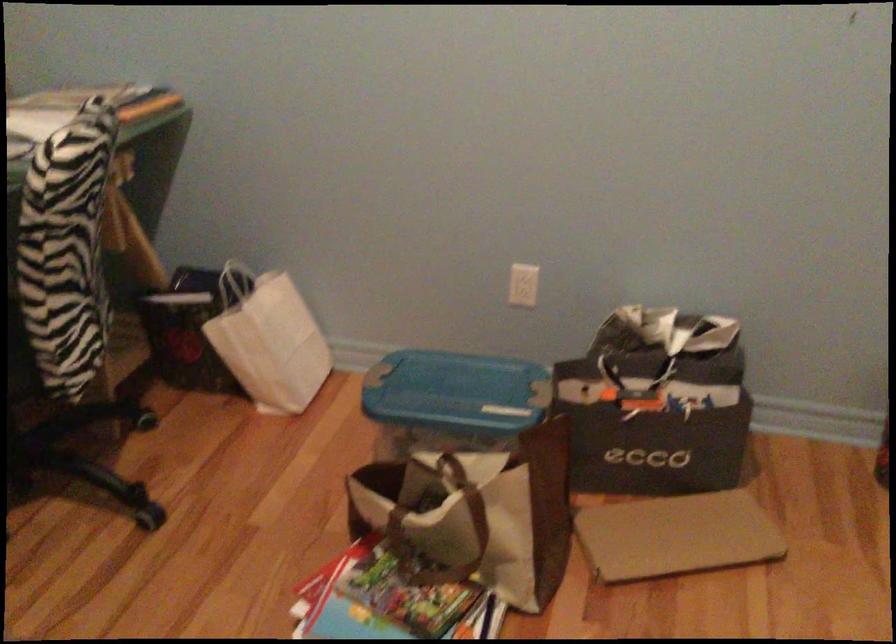
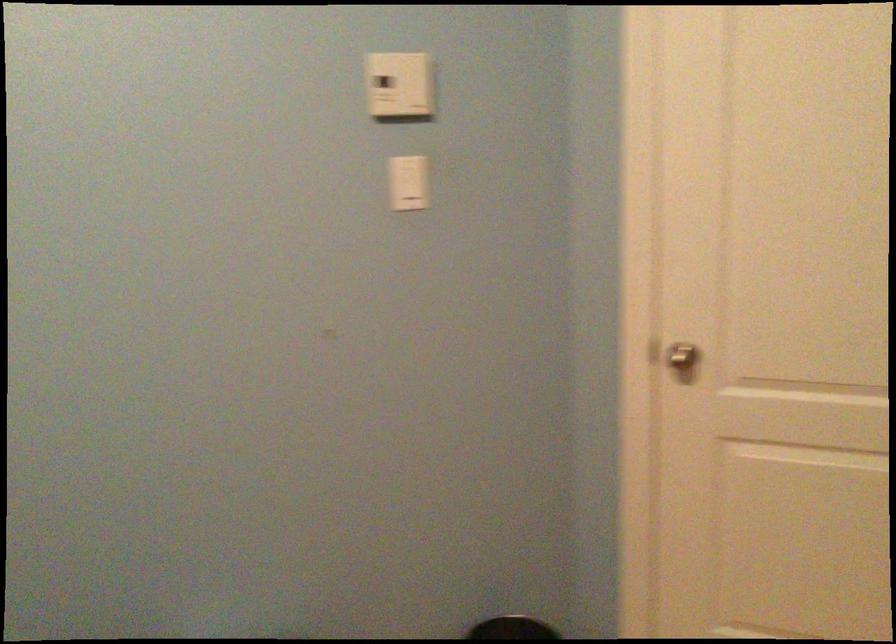
Question: Based on the continuous images, in which direction is the camera rotating? Reply with the corresponding letter.

Choices:
 (A) Left
 (B) Right
 (C) Up
 (D) Down

Answer: (B)